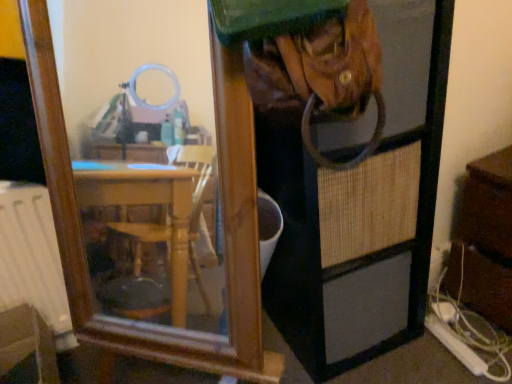
Question: Is brown wooden dresser at right further to camera compared to brown woven screen door at center?

Choices:
 (A) no
 (B) yes

Answer: (B)

Question: Does brown wooden dresser at right appear on the right side of brown woven screen door at center?

Choices:
 (A) no
 (B) yes

Answer: (B)

Question: From the image's perspective, is brown wooden dresser at right below brown woven screen door at center?

Choices:
 (A) no
 (B) yes

Answer: (B)

Question: Is brown wooden dresser at right smaller than brown woven screen door at center?

Choices:
 (A) yes
 (B) no

Answer: (A)

Question: Does brown wooden dresser at right have a greater width compared to brown woven screen door at center?

Choices:
 (A) no
 (B) yes

Answer: (B)

Question: Relative to brown woven screen door at center, is brown wooden dresser at right in front or behind?

Choices:
 (A) front
 (B) behind

Answer: (B)

Question: Looking at the image, does brown wooden dresser at right seem bigger or smaller compared to brown woven screen door at center?

Choices:
 (A) big
 (B) small

Answer: (B)

Question: From the image's perspective, is brown wooden dresser at right positioned above or below brown woven screen door at center?

Choices:
 (A) above
 (B) below

Answer: (B)

Question: Is brown wooden dresser at right spatially inside brown woven screen door at center, or outside of it?

Choices:
 (A) outside
 (B) inside

Answer: (A)

Question: Is point (324, 87) positioned closer to the camera than point (478, 311)?

Choices:
 (A) closer
 (B) farther

Answer: (A)

Question: Is brown woven screen door at center situated inside brown wooden dresser at right or outside?

Choices:
 (A) outside
 (B) inside

Answer: (A)

Question: From their relative heights in the image, would you say brown woven screen door at center is taller or shorter than brown wooden dresser at right?

Choices:
 (A) short
 (B) tall

Answer: (B)

Question: In the image, is brown woven screen door at center positioned in front of or behind brown wooden dresser at right?

Choices:
 (A) front
 (B) behind

Answer: (A)

Question: Is brushed metal water at lower left wider or thinner than brown woven screen door at center?

Choices:
 (A) thin
 (B) wide

Answer: (B)

Question: Looking at the image, does brushed metal water at lower left seem bigger or smaller compared to brown woven screen door at center?

Choices:
 (A) small
 (B) big

Answer: (A)